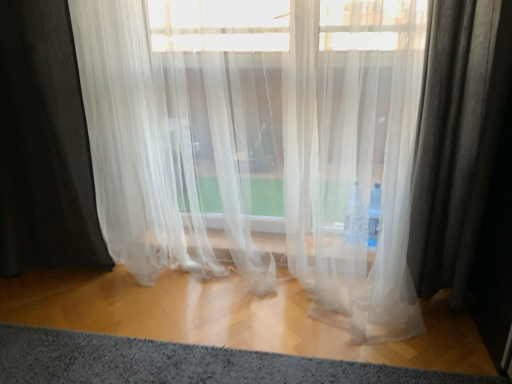
You are a GUI agent. You are given a task and a screenshot of the screen. Output one action in this format:
    pyautogui.click(x=<x>, y=<y>)
    Task: Click on the vacant area that lies between translucent white curtain at center and gray soft rug at lower center
    Image resolution: width=512 pixels, height=384 pixels.
    Given the screenshot: What is the action you would take?
    pyautogui.click(x=224, y=330)